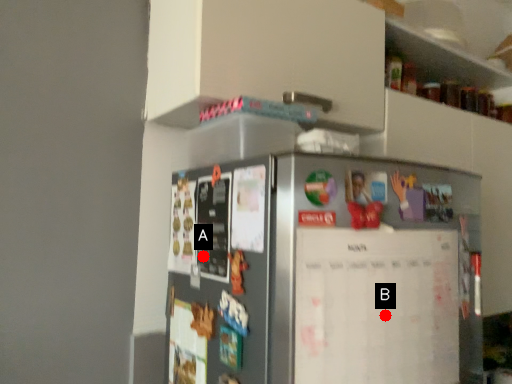
Question: Two points are circled on the image, labeled by A and B beside each circle. Among these points, which one is nearest to the camera?

Choices:
 (A) A is closer
 (B) B is closer

Answer: (B)